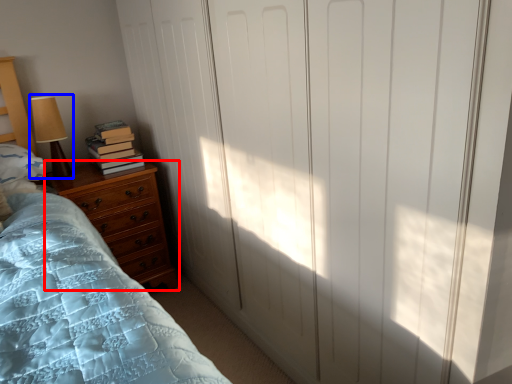
Question: Which point is closer to the camera, chest of drawers (highlighted by a red box) or table lamp (highlighted by a blue box)?

Choices:
 (A) chest of drawers
 (B) table lamp

Answer: (A)